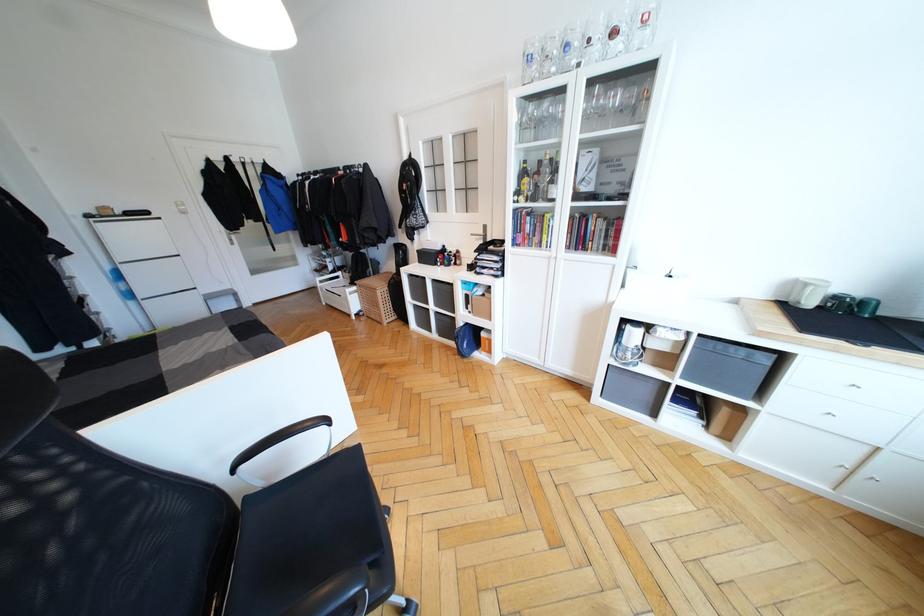
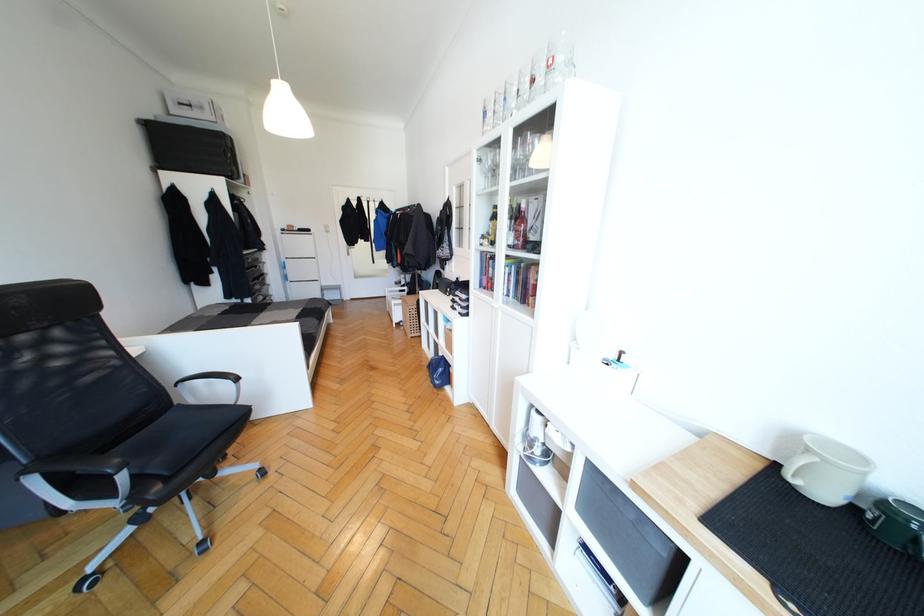
In the second image, find the point that corresponds to [469,333] in the first image.

(445, 363)